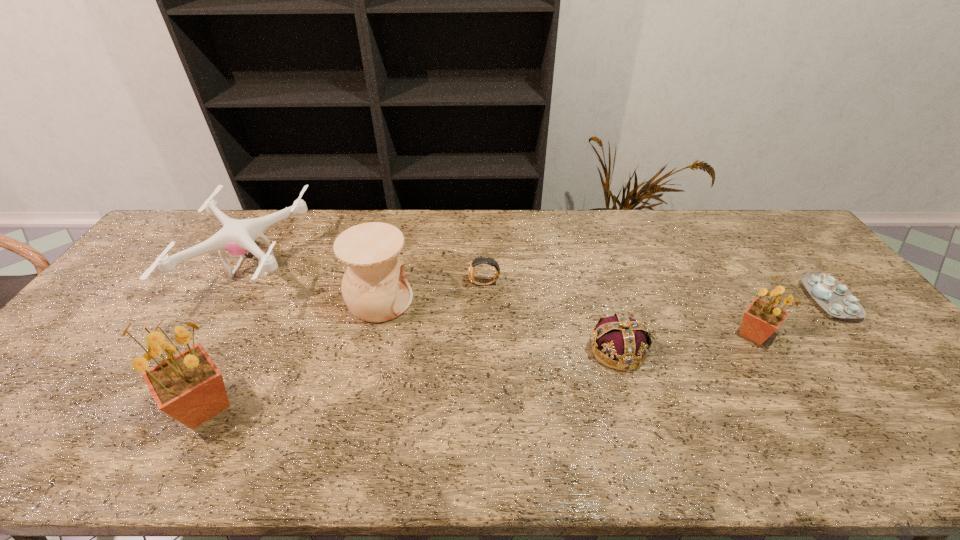
Where is `vacant region located 0.200m on the face of the sixth tallest object`? This screenshot has width=960, height=540. vacant region located 0.200m on the face of the sixth tallest object is located at coordinates (403, 284).

Where is `object that is positioned at the far edge`? The height and width of the screenshot is (540, 960). object that is positioned at the far edge is located at coordinates (x=237, y=237).

Where is `object positioned at the near edge`? object positioned at the near edge is located at coordinates (189, 387).

Find the location of `object that is positioned at the right edge`. object that is positioned at the right edge is located at coordinates (834, 297).

Identify the location of vacant region at the far edge of the desktop. The image size is (960, 540). (554, 241).

Locate an element on the screen. free point at the near edge is located at coordinates (334, 393).

You are a GUI agent. You are given a task and a screenshot of the screen. Output one action in this format:
    pyautogui.click(x=<x>, y=<y>)
    Task: Click on the free space at the right edge of the desktop
    This screenshot has width=960, height=540.
    Given the screenshot: What is the action you would take?
    pyautogui.click(x=824, y=330)

The image size is (960, 540). I want to click on blank space at the far left corner of the desktop, so [188, 240].

The width and height of the screenshot is (960, 540). In the image, there is a desktop. In order to click on vacant space at the far right corner in this screenshot , I will do (x=789, y=247).

You are a GUI agent. You are given a task and a screenshot of the screen. Output one action in this format:
    pyautogui.click(x=<x>, y=<y>)
    Task: Click on the vacant space that is in between the taller sunflower and the sixth object from left to right
    The height and width of the screenshot is (540, 960).
    Given the screenshot: What is the action you would take?
    pyautogui.click(x=479, y=370)